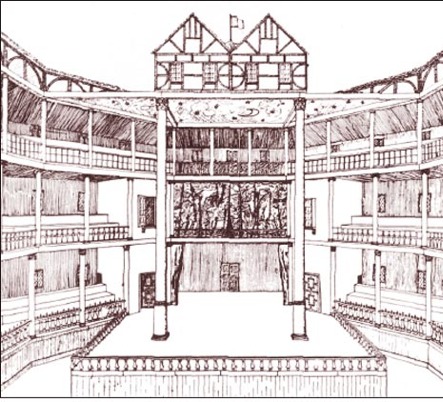
Where is `door`? The image size is (443, 402). door is located at coordinates (230, 277), (150, 287), (310, 298).